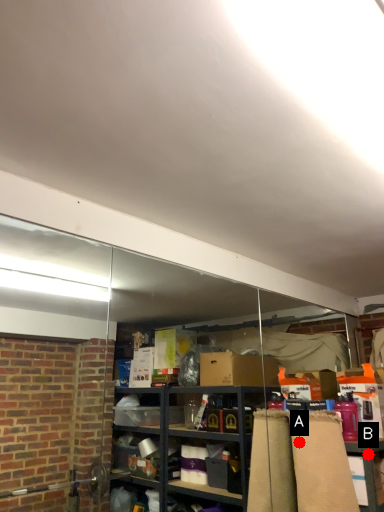
Question: Two points are circled on the image, labeled by A and B beside each circle. Which point is closer to the camera?

Choices:
 (A) A is closer
 (B) B is closer

Answer: (B)